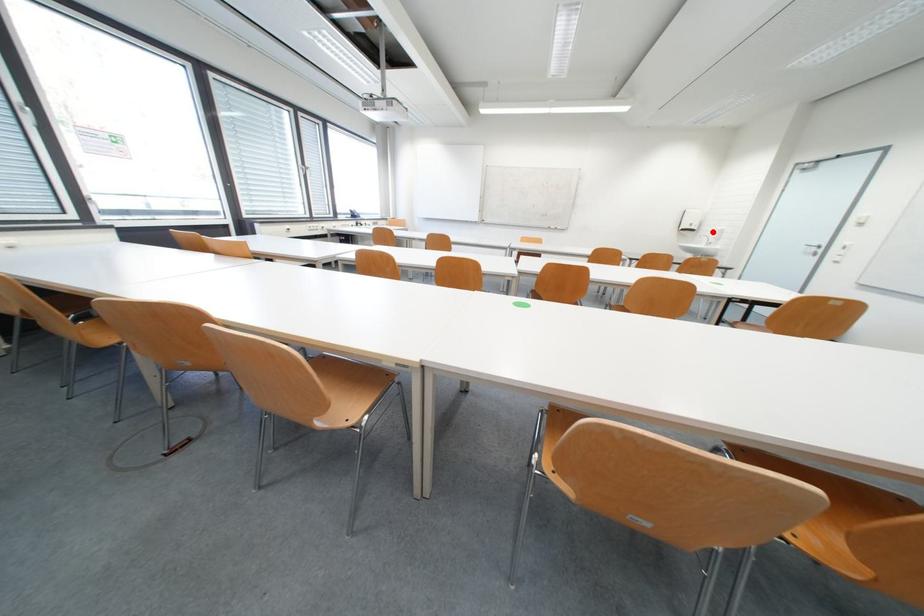
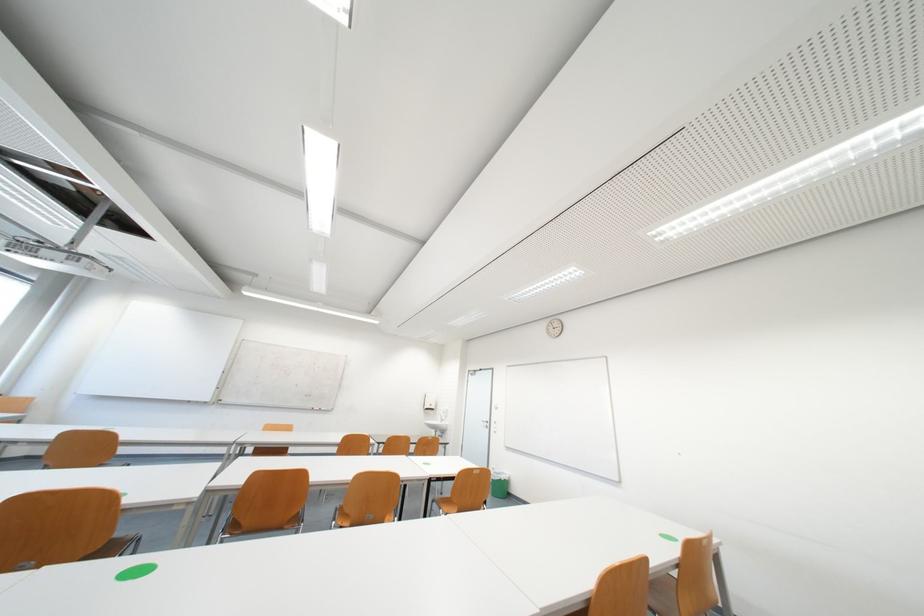
Question: I am providing you with two images of the same scene from different viewpoints. A red point is shown in image1. For the corresponding object point in image2, is it positioned nearer or farther from the camera?

Choices:
 (A) Nearer
 (B) Farther

Answer: (B)